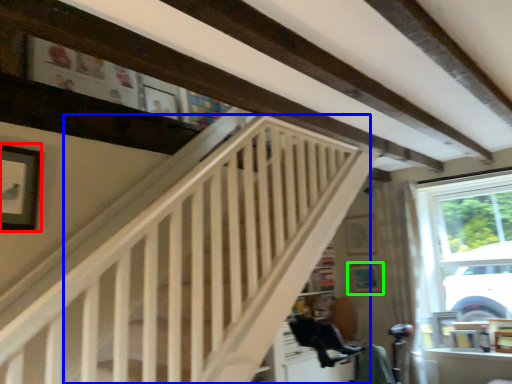
Question: Which object is positioned farthest from picture frame (highlighted by a red box)? Select from stairwell (highlighted by a blue box) and picture frame (highlighted by a green box).

Choices:
 (A) stairwell
 (B) picture frame

Answer: (B)